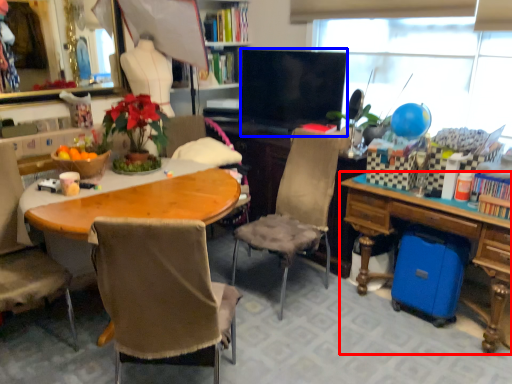
Question: Which of the following is the farthest to the observer, desk (highlighted by a red box) or television (highlighted by a blue box)?

Choices:
 (A) desk
 (B) television

Answer: (B)